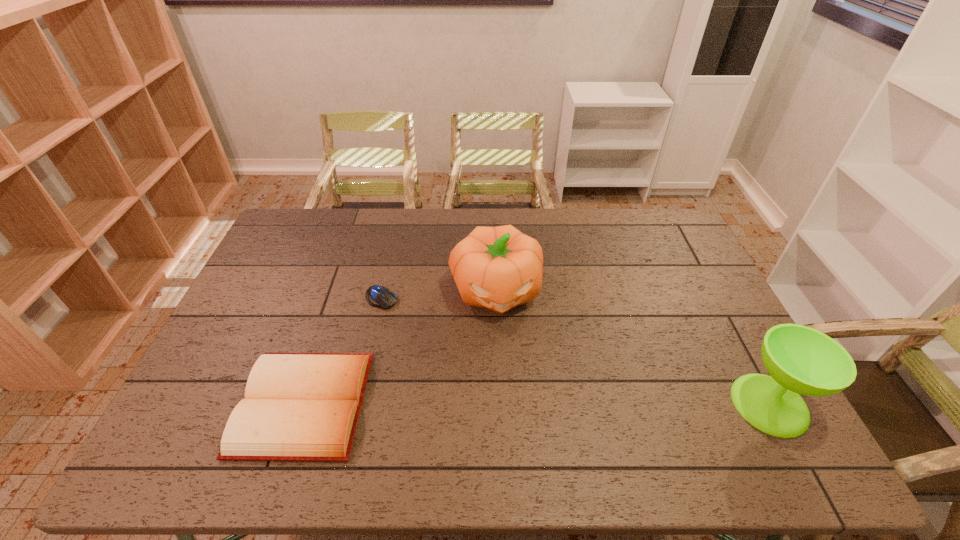
Locate an element on the screen. unoccupied position between the wineglass and the pumpkin is located at coordinates (633, 347).

Find the location of a particular element. vacant point located between the wineglass and the third object from left to right is located at coordinates (633, 347).

What are the coordinates of `vacant space in between the shortest object and the wineglass` in the screenshot? It's located at (575, 352).

Find the location of a particular element. vacant space that is in between the rightmost object and the second shortest object is located at coordinates (537, 404).

Locate which object ranks in proximity to the wineglass. Please provide its 2D coordinates. Your answer should be formatted as a tuple, i.e. [(x, y)], where the tuple contains the x and y coordinates of a point satisfying the conditions above.

[(498, 268)]

This screenshot has width=960, height=540. I want to click on object that can be found as the third closest to the shortest object, so click(801, 360).

The width and height of the screenshot is (960, 540). What are the coordinates of `free region that satisfies the following two spatial constraints: 1. on the front side of the shortest object; 2. on the right side of the rightmost object` in the screenshot? It's located at (357, 404).

I want to click on free location that satisfies the following two spatial constraints: 1. on the back side of the second shortest object; 2. on the right side of the shortest object, so click(x=338, y=299).

The width and height of the screenshot is (960, 540). Identify the location of free space that satisfies the following two spatial constraints: 1. on the front side of the wineglass; 2. on the right side of the third object from left to right. (500, 404).

At what (x,y) coordinates should I click in order to perform the action: click on vacant area that satisfies the following two spatial constraints: 1. on the back side of the shortest object; 2. on the left side of the second object from right to left. Please return your answer as a coordinate pair (x, y). Looking at the image, I should click on (383, 290).